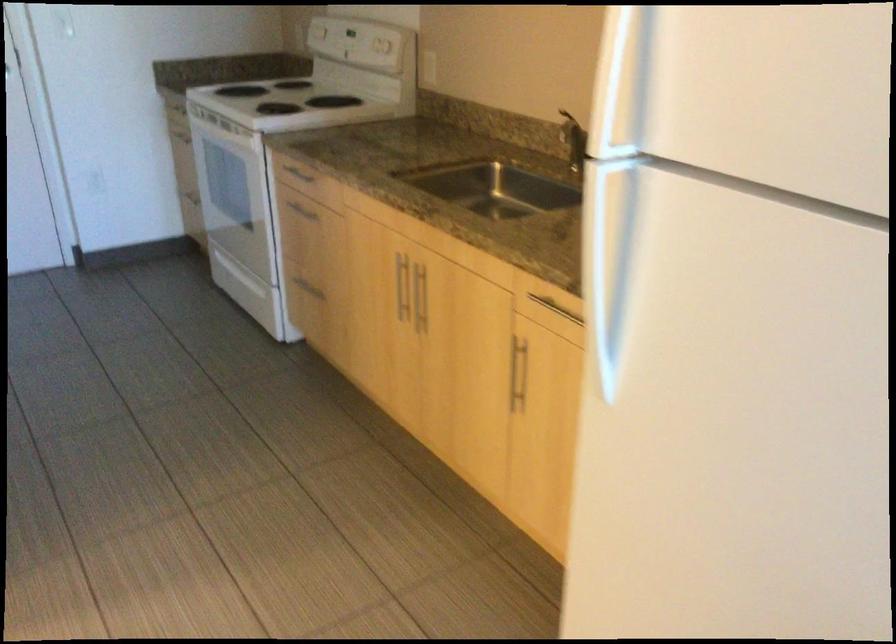
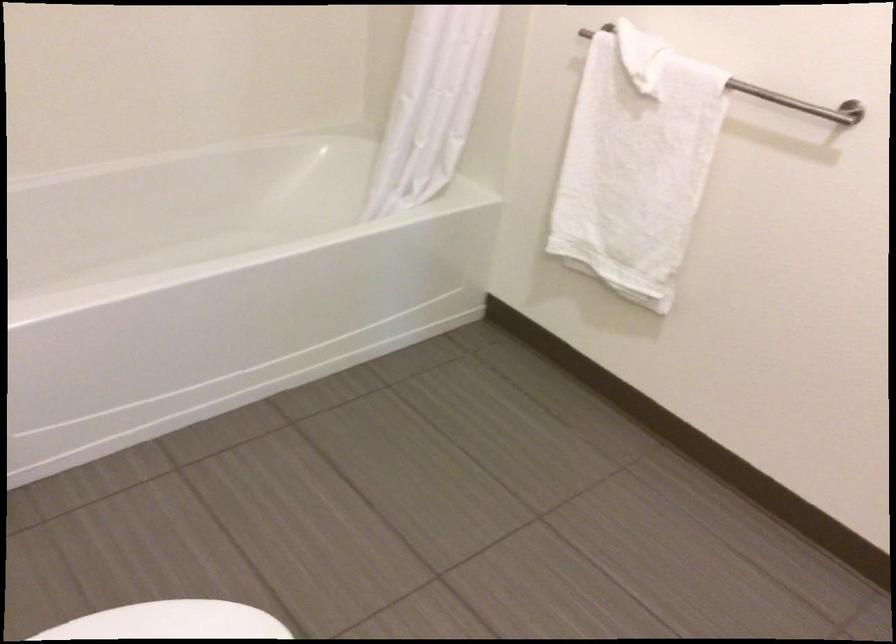
Question: What movement of the cameraman would produce the second image?

Choices:
 (A) Left
 (B) Right
 (C) Forward
 (D) Backward

Answer: (A)